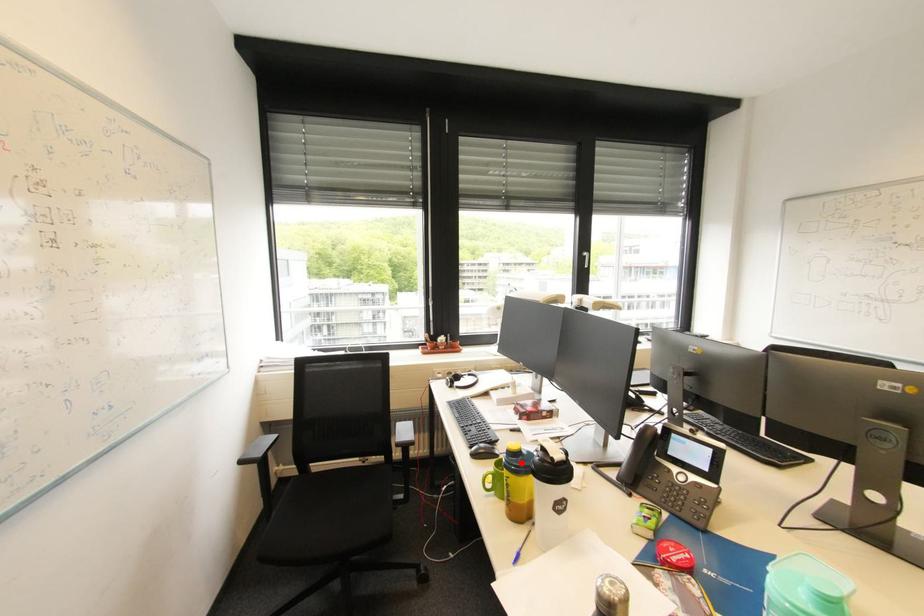
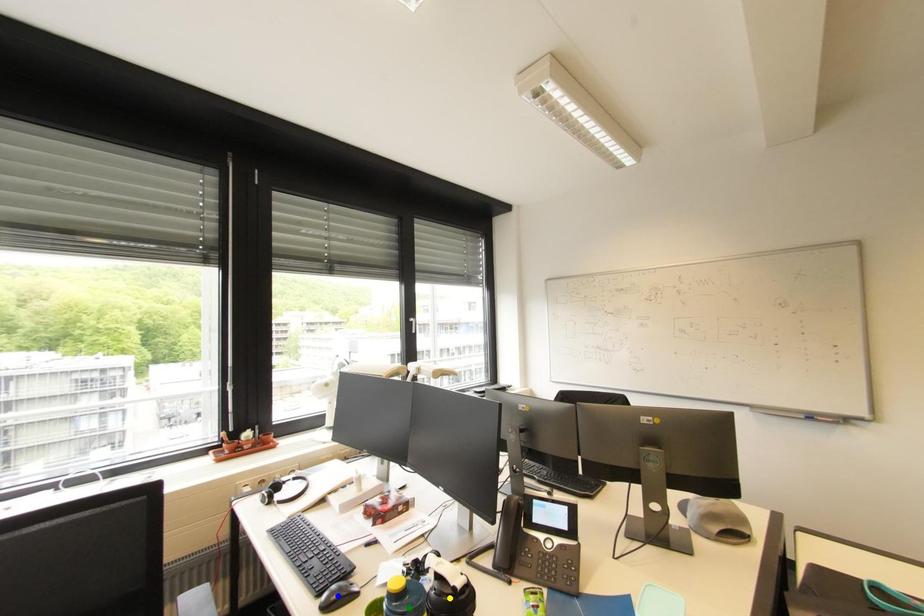
Question: I am providing you with two images of the same scene from different viewpoints. A red point is marked on the first image. You are given multiple points on the second image. Which point in image 2 is actually the same real-world point as the red point in image 1?

Choices:
 (A) blue point
 (B) yellow point
 (C) green point

Answer: (C)